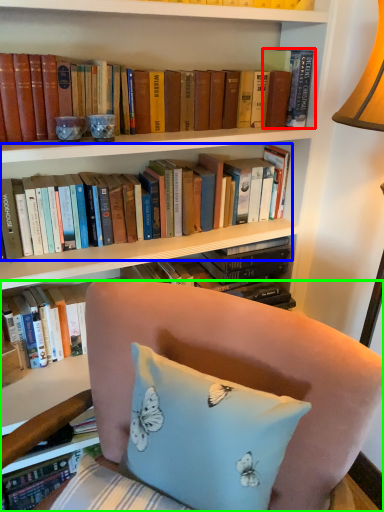
Question: Which object is positioned closest to book (highlighted by a red box)? Select from book (highlighted by a blue box) and chair (highlighted by a green box).

Choices:
 (A) book
 (B) chair

Answer: (A)